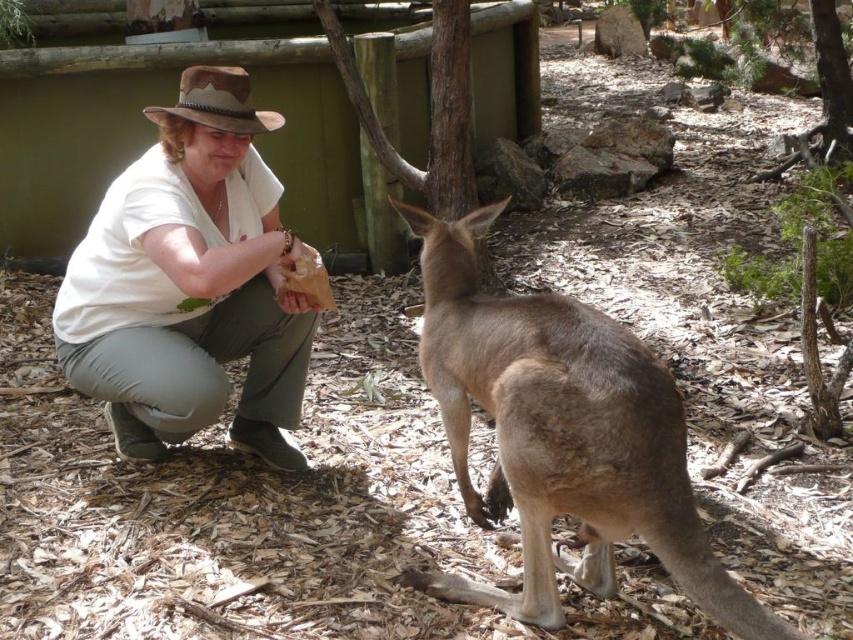
Question: Is brown furry kangaroo at center to the right of white cotton shirt at center from the viewer's perspective?

Choices:
 (A) yes
 (B) no

Answer: (A)

Question: Is brown furry kangaroo at center above white cotton shirt at center?

Choices:
 (A) no
 (B) yes

Answer: (A)

Question: Considering the relative positions of brown furry kangaroo at center and white cotton shirt at center in the image provided, where is brown furry kangaroo at center located with respect to white cotton shirt at center?

Choices:
 (A) below
 (B) above

Answer: (A)

Question: Which point appears farthest from the camera in this image?

Choices:
 (A) (526, 348)
 (B) (248, 332)

Answer: (B)